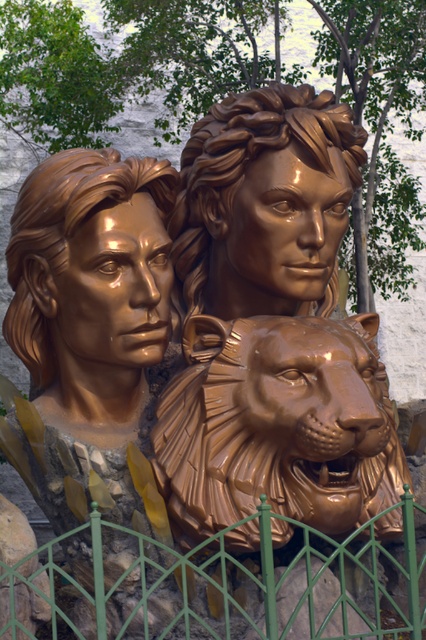
What do you see at coordinates (250, 161) in the screenshot? The width and height of the screenshot is (426, 640). I see `shiny bronze head at center` at bounding box center [250, 161].

Between point (334, 278) and point (261, 205), which one is positioned in front?

Positioned in front is point (261, 205).

Identify the location of shiny bronze head at center. The height and width of the screenshot is (640, 426). (250, 161).

Between point (249, 141) and point (121, 257), which one is positioned behind?

Point (249, 141)

You are a GUI agent. You are given a task and a screenshot of the screen. Output one action in this format:
    pyautogui.click(x=<x>, y=<y>)
    Task: Click on the shiny bronze head at center
    The image size is (426, 640).
    Given the screenshot: What is the action you would take?
    pyautogui.click(x=250, y=161)

Locate an element on the screen. The image size is (426, 640). shiny bronze head at center is located at coordinates (250, 161).

Image resolution: width=426 pixels, height=640 pixels. I want to click on shiny bronze head at center, so click(250, 161).

Who is lower down, green metal fence at lower center or shiny bronze head at center?

green metal fence at lower center is lower down.

Consider the image. Can you confirm if green metal fence at lower center is positioned to the right of shiny bronze head at center?

No, green metal fence at lower center is not to the right of shiny bronze head at center.

Who is more forward, (x=270, y=632) or (x=359, y=140)?

Positioned in front is point (x=270, y=632).

This screenshot has width=426, height=640. I want to click on green metal fence at lower center, so click(230, 586).